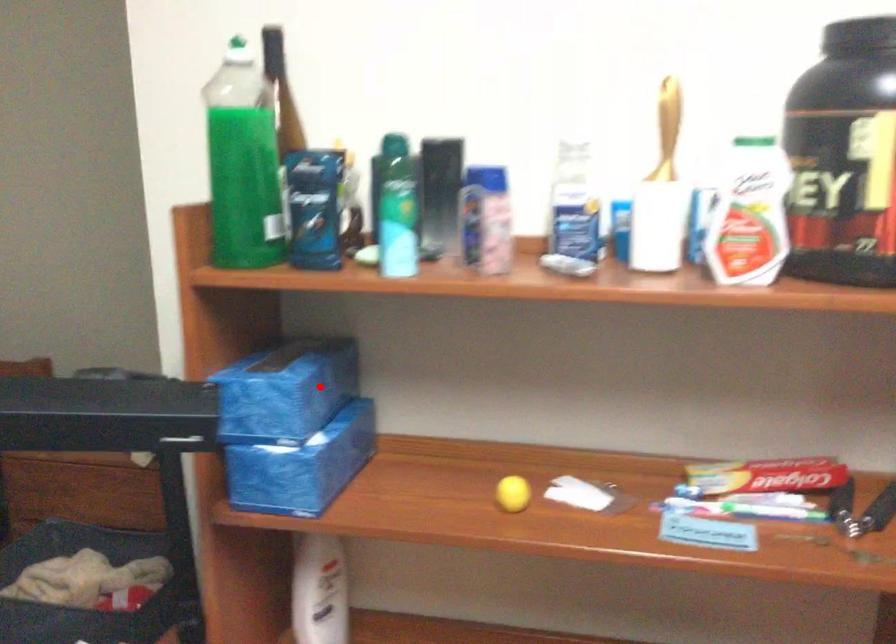
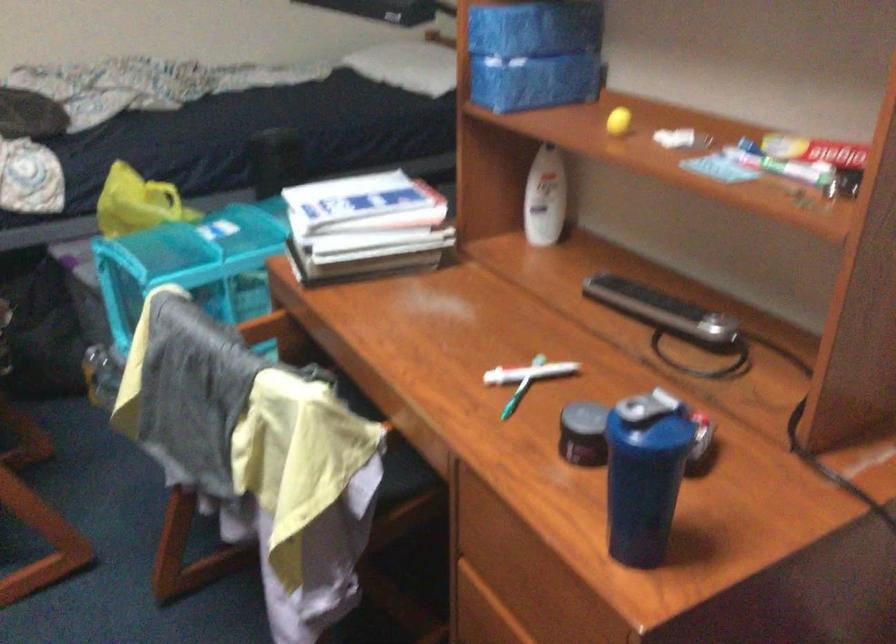
Where in the second image is the point corresponding to the highlighted location from the first image?

(536, 26)